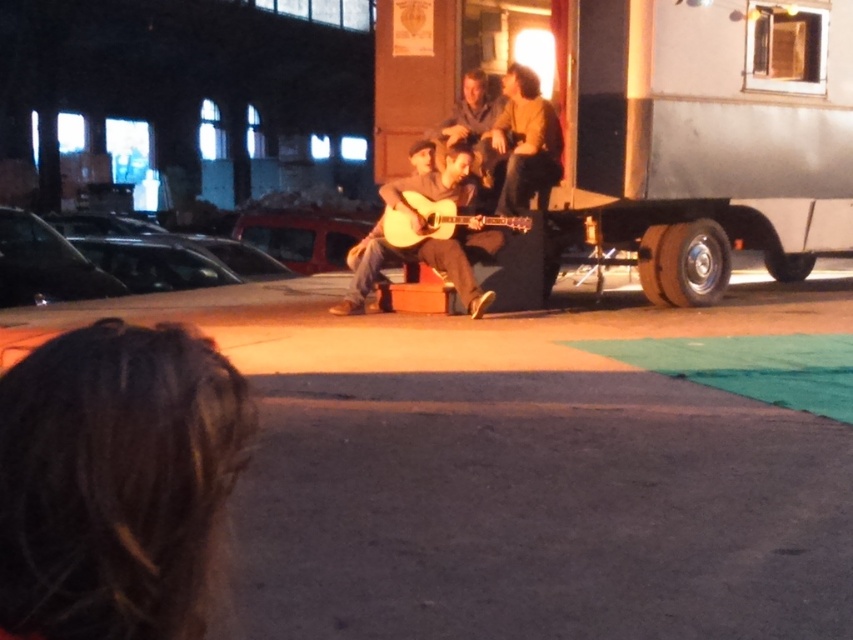
Can you confirm if wooden acoustic guitar at center is wider than acoustic wood guitar at center?

Correct, the width of wooden acoustic guitar at center exceeds that of acoustic wood guitar at center.

Between point (445, 173) and point (439, 202), which one is positioned behind?

Positioned behind is point (445, 173).

Is point (456, 172) farther from camera compared to point (440, 202)?

Yes, point (456, 172) is farther from viewer.

This screenshot has width=853, height=640. I want to click on wooden acoustic guitar at center, so click(425, 260).